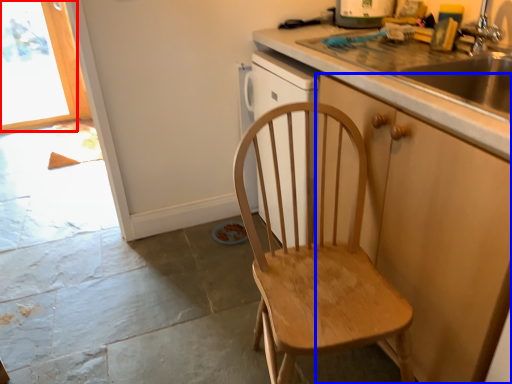
Question: Which of the following is the closest to the observer, window (highlighted by a red box) or cabinetry (highlighted by a blue box)?

Choices:
 (A) window
 (B) cabinetry

Answer: (B)